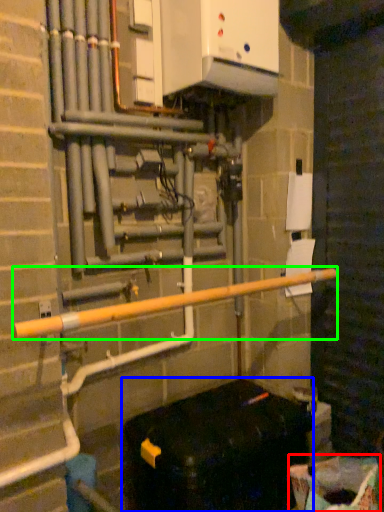
Question: Which object is the closest to the recycling bin (highlighted by a red box)? Choose among these: furniture (highlighted by a blue box) or rail (highlighted by a green box).

Choices:
 (A) furniture
 (B) rail

Answer: (A)